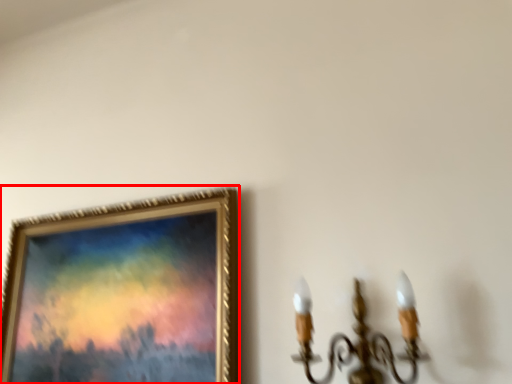
Question: From the image's perspective, what is the correct spatial relationship of picture frame (annotated by the red box) in relation to lamp?

Choices:
 (A) below
 (B) above

Answer: (A)